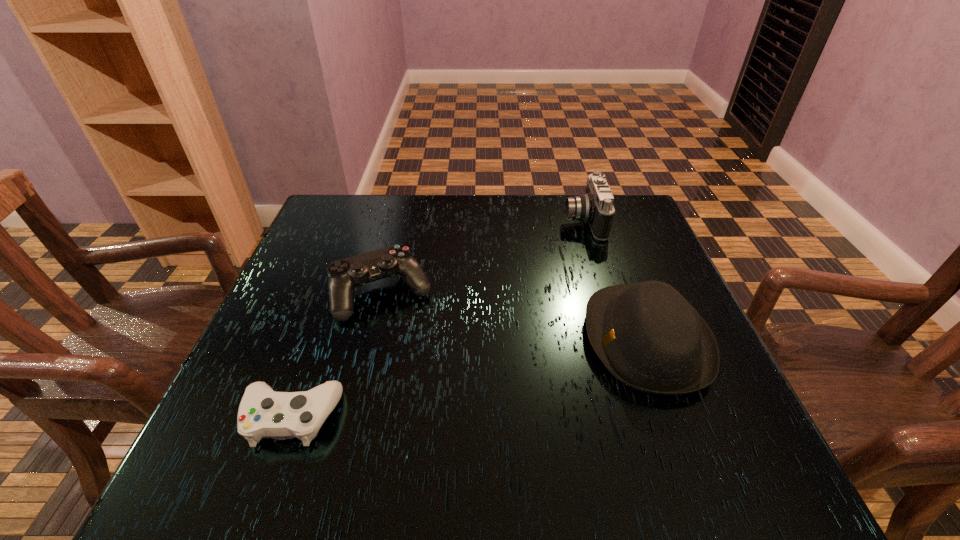
I want to click on empty location between the fedora and the farthest object, so click(615, 281).

The image size is (960, 540). In order to click on free space that is in between the nearer control and the farthest object in this screenshot , I will do `click(438, 320)`.

The image size is (960, 540). What are the coordinates of `free space between the shortest object and the fedora` in the screenshot? It's located at (469, 379).

This screenshot has width=960, height=540. I want to click on unoccupied area between the fedora and the shorter control, so click(469, 379).

Find the location of a particular element. Image resolution: width=960 pixels, height=540 pixels. unoccupied area between the nearer control and the taller control is located at coordinates (337, 355).

Find the location of `free area in between the farther control and the shortest object`. free area in between the farther control and the shortest object is located at coordinates (337, 355).

I want to click on vacant space that's between the nearer control and the taller control, so click(x=337, y=355).

Point out which object is positioned as the nearest to the taller control. Please provide its 2D coordinates. Your answer should be formatted as a tuple, i.e. [(x, y)], where the tuple contains the x and y coordinates of a point satisfying the conditions above.

[(263, 413)]

Point out which object is positioned as the third nearest to the shorter control. Please provide its 2D coordinates. Your answer should be formatted as a tuple, i.e. [(x, y)], where the tuple contains the x and y coordinates of a point satisfying the conditions above.

[(596, 208)]

At what (x,y) coordinates should I click in order to perform the action: click on vacant space that satisfies the following two spatial constraints: 1. on the front-facing side of the farthest object; 2. on the front side of the nearer control. Please return your answer as a coordinate pair (x, y). Looking at the image, I should click on (645, 417).